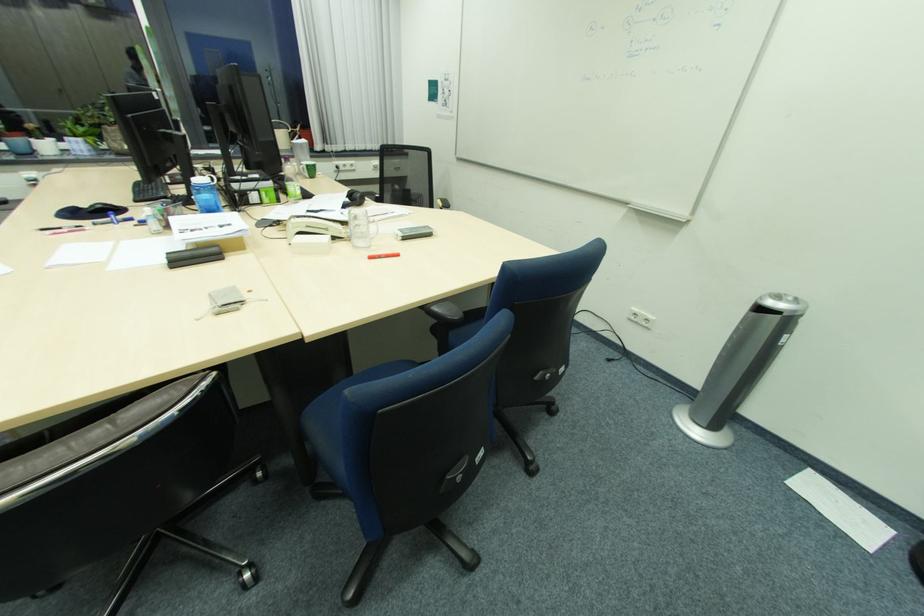
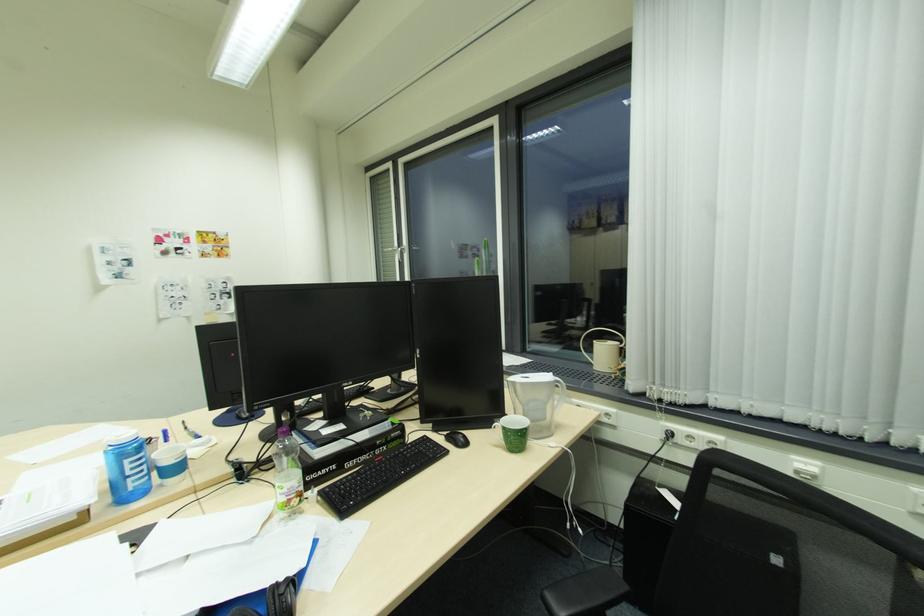
Where in the second image is the point corresponding to (x=344, y=168) from the first image?

(675, 435)